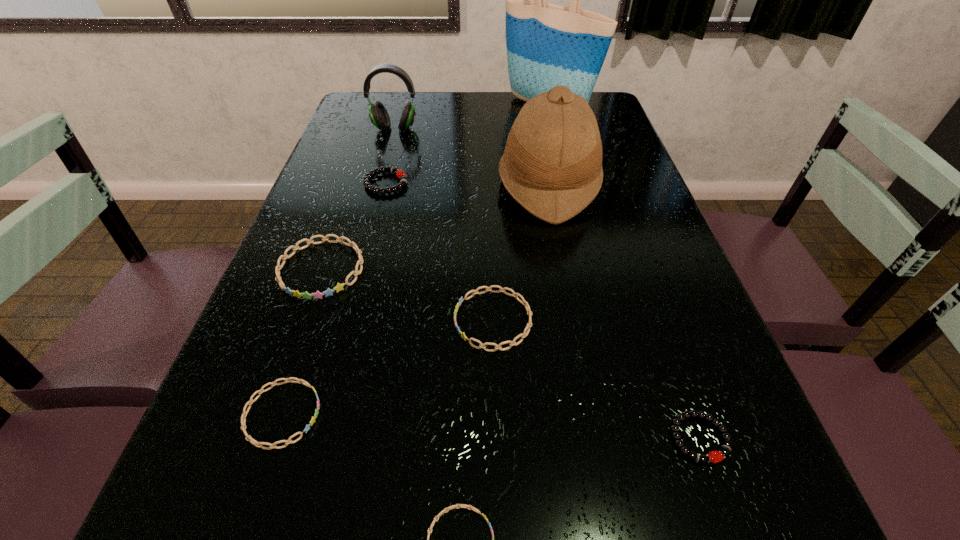
Where is `vacant area located on the surface of the second biggest blue bracelet showing star-shaped elements`? vacant area located on the surface of the second biggest blue bracelet showing star-shaped elements is located at coordinates (339, 320).

Locate an element on the screen. blank area located on the surface of the second biggest blue bracelet showing star-shaped elements is located at coordinates (271, 320).

Image resolution: width=960 pixels, height=540 pixels. Identify the location of free space located on the front of the bigger black bracelet. (351, 318).

The image size is (960, 540). I want to click on vacant space located 0.290m on the surface of the third farthest blue bracelet showing star-shaped elements, so click(500, 414).

Where is `vacant region located 0.330m on the back of the right black bracelet`? The width and height of the screenshot is (960, 540). vacant region located 0.330m on the back of the right black bracelet is located at coordinates (639, 268).

The height and width of the screenshot is (540, 960). I want to click on tote bag at the far edge, so coord(548,45).

I want to click on headset located in the far edge section of the desktop, so click(378, 114).

Find the location of a particular element. The width and height of the screenshot is (960, 540). headset present at the left edge is located at coordinates (378, 114).

Image resolution: width=960 pixels, height=540 pixels. In order to click on tote bag that is positioned at the right edge in this screenshot , I will do `click(548, 45)`.

Find the location of `hat at the right edge`. hat at the right edge is located at coordinates (552, 163).